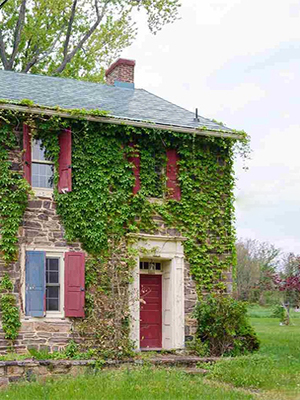
The height and width of the screenshot is (400, 300). Find the location of `1st story window`. 1st story window is located at coordinates (54, 292).